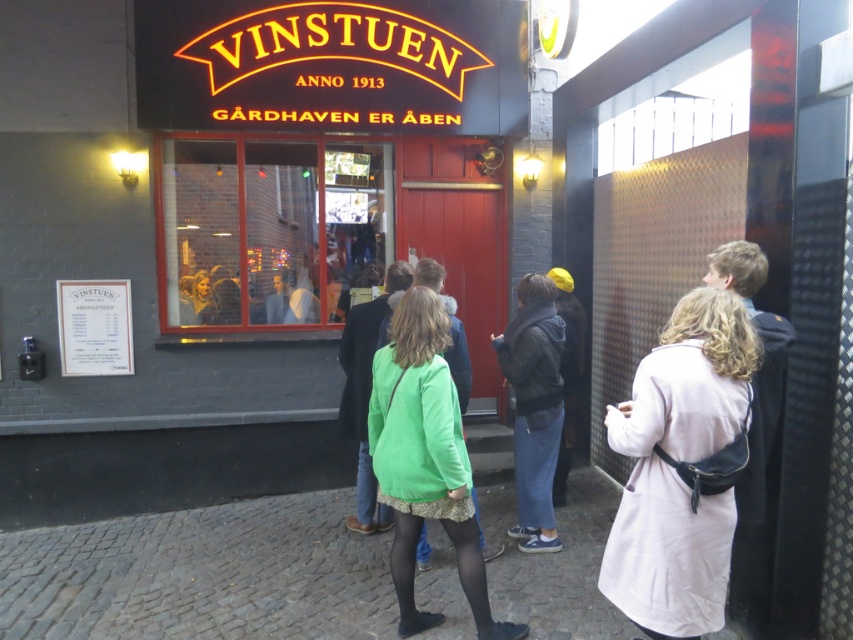
Measure the distance from denim jacket at center to light pink fabric coat at right.

A distance of 1.36 meters exists between denim jacket at center and light pink fabric coat at right.

Is denim jacket at center to the left of light pink fabric coat at right from the viewer's perspective?

Indeed, denim jacket at center is positioned on the left side of light pink fabric coat at right.

What are the coordinates of `denim jacket at center` in the screenshot? It's located at (534, 406).

Can you confirm if light pink fabric coat at right is positioned to the right of green fabric coat at center?

Indeed, light pink fabric coat at right is positioned on the right side of green fabric coat at center.

From the picture: Is light pink fabric coat at right closer to the viewer compared to green fabric coat at center?

Yes, light pink fabric coat at right is closer to the viewer.

Which is behind, point (759, 572) or point (364, 397)?

Point (364, 397)

Identify the location of light pink fabric coat at right. (756, 416).

Does light beige coat at center appear on the left side of green fabric coat at center?

In fact, light beige coat at center is to the right of green fabric coat at center.

Which of these two, light beige coat at center or green fabric coat at center, stands shorter?

light beige coat at center

Is point (630, 448) more distant than point (355, 531)?

No, (630, 448) is closer to viewer.

Find the location of a particular element. light beige coat at center is located at coordinates (676, 470).